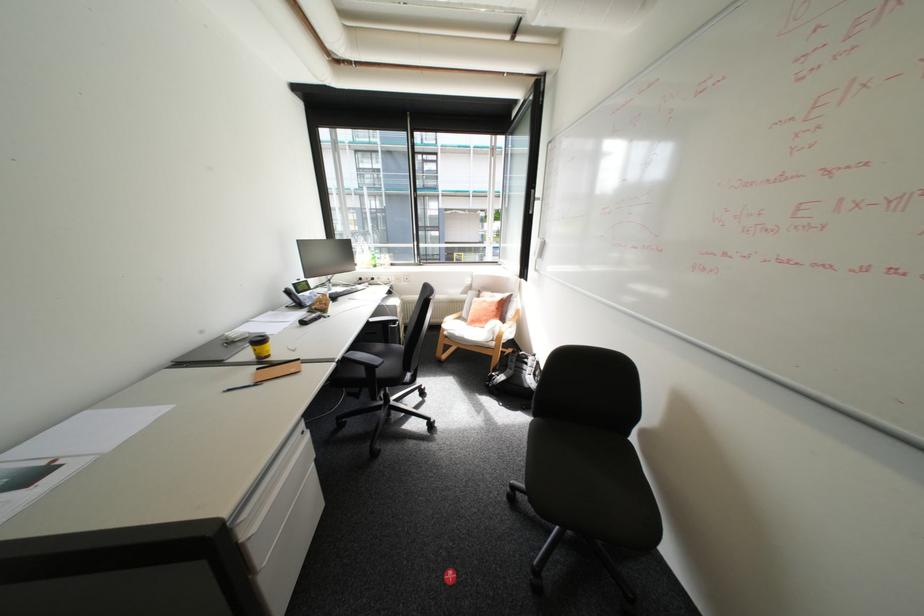
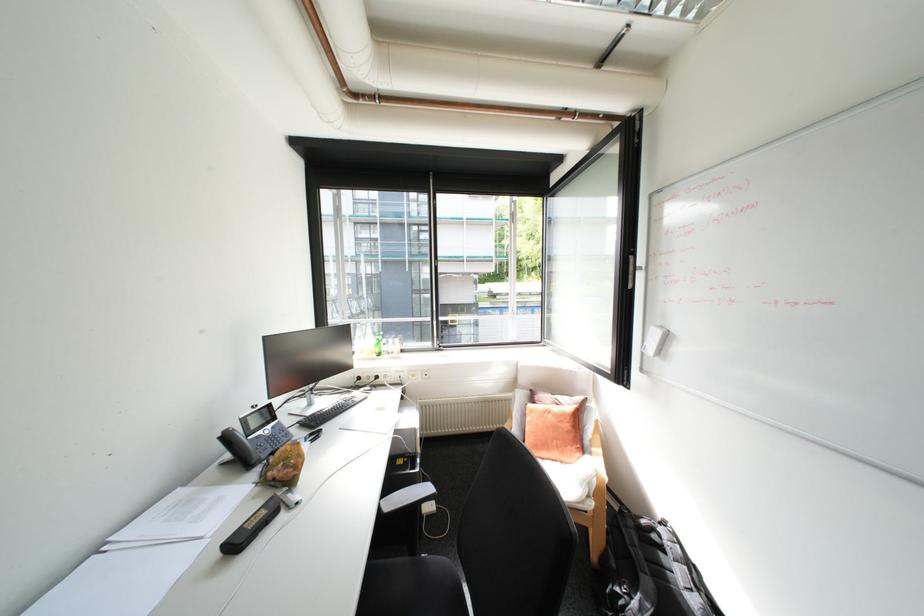
The point at [494,302] is marked in the first image. Where is the corresponding point in the second image?

(561, 416)